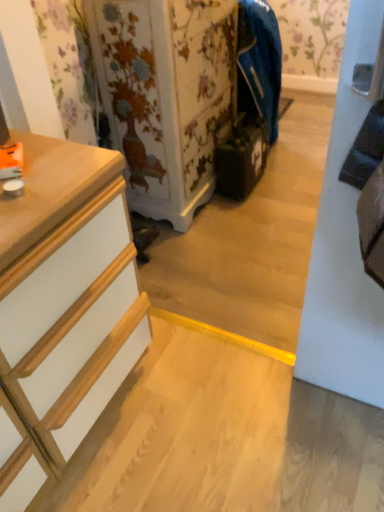
What do you see at coordinates (67, 292) in the screenshot? I see `white matte wooden chest of drawers at left` at bounding box center [67, 292].

Locate an element on the screen. white matte wooden chest of drawers at left is located at coordinates (67, 292).

Identify the location of white matte wooden chest of drawers at left. (67, 292).